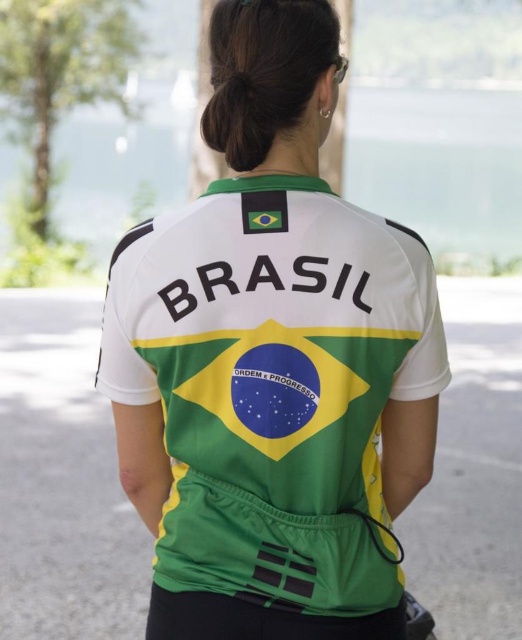
Consider the image. Which is below, white jersey at center or black hair at upper center?

white jersey at center is lower down.

Is point (292, 81) farther from viewer compared to point (219, 35)?

No, it is in front of (219, 35).

The width and height of the screenshot is (522, 640). I want to click on white jersey at center, so [x=272, y=362].